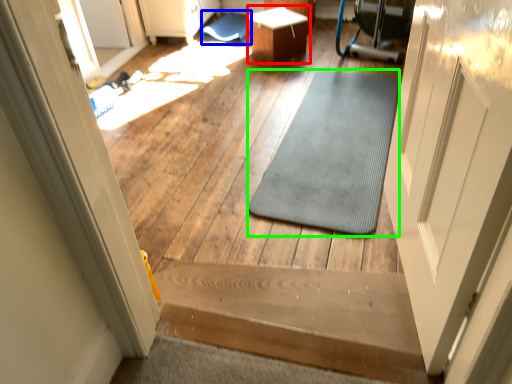
Question: Based on their relative distances, which object is nearer to table (highlighted by a red box)? Choose from bath mat (highlighted by a blue box) and mat (highlighted by a green box).

Choices:
 (A) bath mat
 (B) mat

Answer: (A)